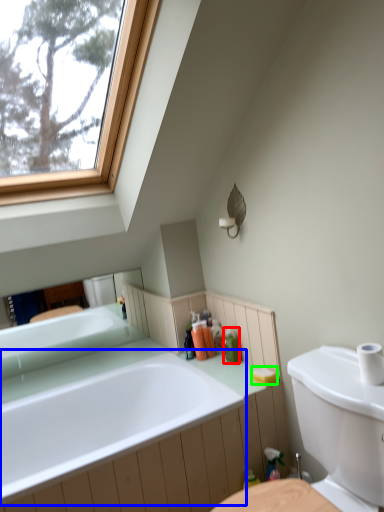
Question: Which is nearer to the toiletry (highlighted by a red box)? bathtub (highlighted by a blue box) or soap (highlighted by a green box).

Choices:
 (A) bathtub
 (B) soap

Answer: (B)